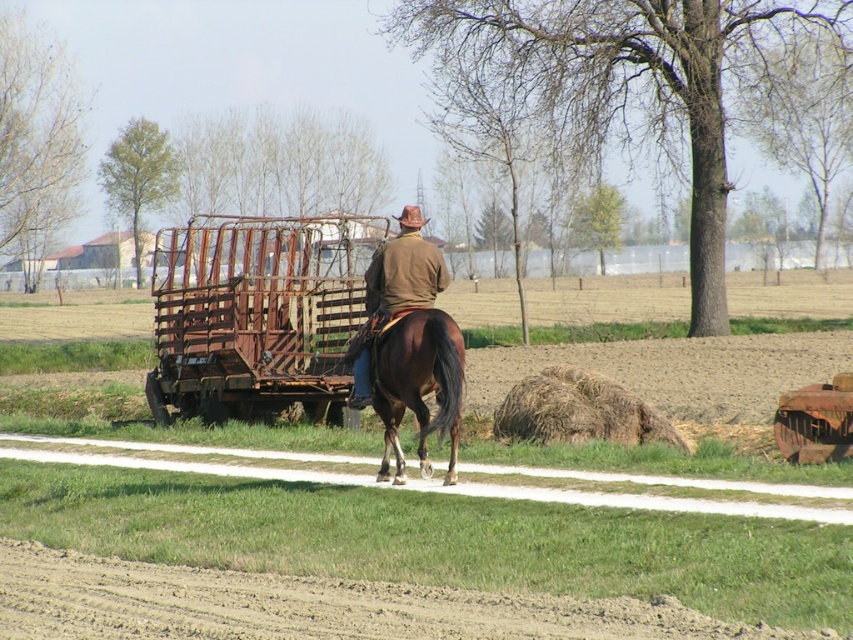
Question: Which point is farther to the camera?

Choices:
 (A) (254, 248)
 (B) (19, 554)
 (C) (643, 419)

Answer: (A)

Question: Does dusty brown dirt track at lower left have a smaller size compared to rusty metal wagon at center?

Choices:
 (A) yes
 (B) no

Answer: (A)

Question: Which object is positioned closest to the rusty metal wagon at center?

Choices:
 (A) brown straw bale at right
 (B) dusty brown dirt track at lower left

Answer: (A)

Question: Can you confirm if brown glossy horse at center is wider than brown leather jacket at center?

Choices:
 (A) yes
 (B) no

Answer: (B)

Question: Can you confirm if dusty brown dirt track at lower left is thinner than brown leather jacket at center?

Choices:
 (A) yes
 (B) no

Answer: (B)

Question: Which point appears farthest from the camera in this image?

Choices:
 (A) (669, 440)
 (B) (358, 378)

Answer: (A)